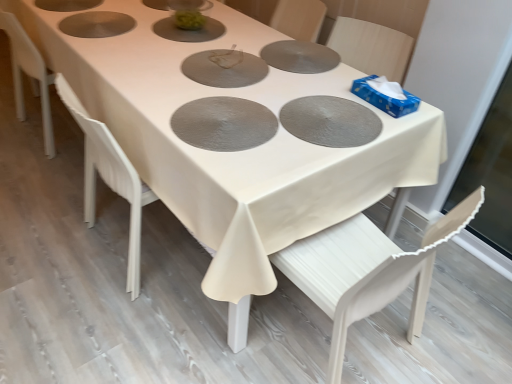
Locate an element on the screen. blank space situated above matte gray pizza pan at center, which is the second pizza pan in bottom-to-top order (from a real-world perspective) is located at coordinates (325, 112).